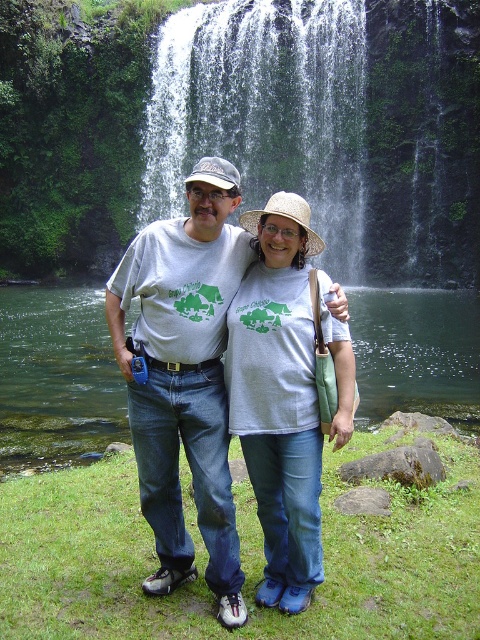
Question: Is white textured water at center smaller than matte gray shirt at center?

Choices:
 (A) yes
 (B) no

Answer: (B)

Question: Can you confirm if white textured water at center is positioned below matte gray t-shirt at center?

Choices:
 (A) yes
 (B) no

Answer: (B)

Question: Estimate the real-world distances between objects in this image. Which object is farther from the matte gray shirt at center?

Choices:
 (A) white textured water at center
 (B) matte gray t-shirt at center

Answer: (A)

Question: Is matte gray t-shirt at center to the right of matte gray shirt at center from the viewer's perspective?

Choices:
 (A) no
 (B) yes

Answer: (A)

Question: Among these points, which one is farthest from the camera?

Choices:
 (A) pos(292,323)
 (B) pos(334,84)

Answer: (B)

Question: Estimate the real-world distances between objects in this image. Which object is farther from the white textured water at center?

Choices:
 (A) matte gray shirt at center
 (B) matte gray t-shirt at center

Answer: (A)